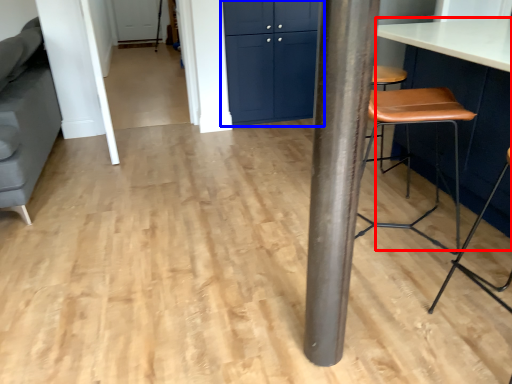
Question: Which object appears closest to the camera in this image, table (highlighted by a red box) or cabinetry (highlighted by a blue box)?

Choices:
 (A) table
 (B) cabinetry

Answer: (A)